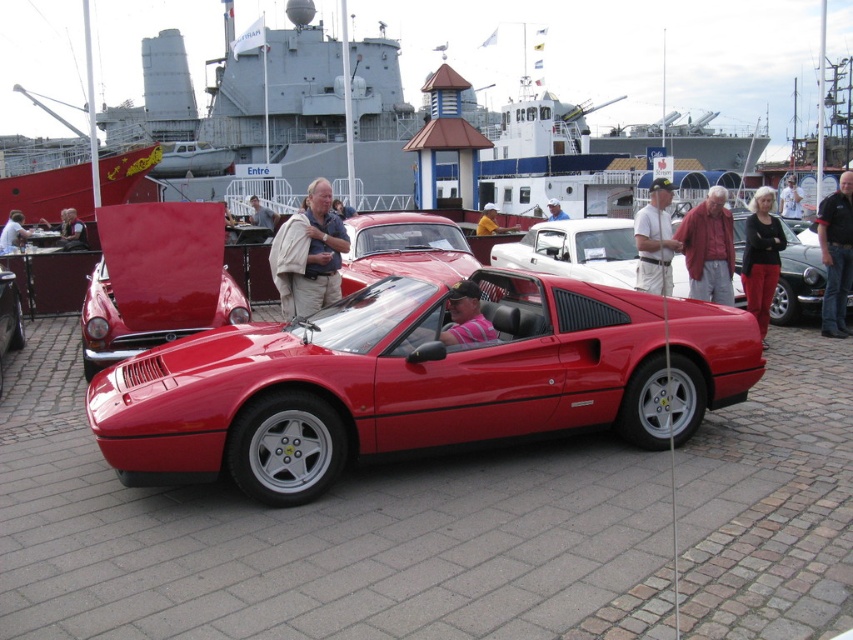
You are a photographer at the car show and want to capture a photo of the shiny red Ferrari at center without any distractions. However, there is a person wearing a red cotton shirt at center in the way. Based on their positions, can you still take a clear photo of the Ferrari?

The red cotton shirt at center is above the shiny red Ferrari at center, so the shirt is positioned higher up in the frame. This means the photographer can still capture the Ferrari clearly by adjusting the camera angle to focus below the shirt or by moving slightly to the side to avoid the obstruction caused by the shirt.